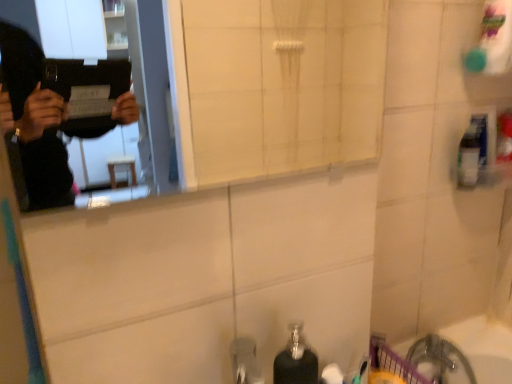
Question: Can you confirm if white plastic bath at lower right is taller than white glossy mirror at upper center?

Choices:
 (A) yes
 (B) no

Answer: (A)

Question: From the image's perspective, would you say white plastic bath at lower right is positioned over white glossy mirror at upper center?

Choices:
 (A) yes
 (B) no

Answer: (B)

Question: Can white glossy mirror at upper center be found inside white plastic bath at lower right?

Choices:
 (A) yes
 (B) no

Answer: (B)

Question: Is white plastic bath at lower right positioned beyond the bounds of white glossy mirror at upper center?

Choices:
 (A) no
 (B) yes

Answer: (B)

Question: Is white plastic bath at lower right in contact with white glossy mirror at upper center?

Choices:
 (A) yes
 (B) no

Answer: (B)

Question: Is the position of white plastic bath at lower right more distant than that of white glossy mirror at upper center?

Choices:
 (A) yes
 (B) no

Answer: (A)

Question: Is clear plastic bottle at upper right touching black matte soap dispenser at lower center?

Choices:
 (A) no
 (B) yes

Answer: (A)

Question: From the image's perspective, is clear plastic bottle at upper right below black matte soap dispenser at lower center?

Choices:
 (A) yes
 (B) no

Answer: (B)

Question: Is clear plastic bottle at upper right positioned beyond the bounds of black matte soap dispenser at lower center?

Choices:
 (A) no
 (B) yes

Answer: (B)

Question: Is clear plastic bottle at upper right surrounding black matte soap dispenser at lower center?

Choices:
 (A) no
 (B) yes

Answer: (A)

Question: Can you confirm if clear plastic bottle at upper right is positioned to the left of black matte soap dispenser at lower center?

Choices:
 (A) no
 (B) yes

Answer: (A)

Question: Can you confirm if clear plastic bottle at upper right is thinner than black matte soap dispenser at lower center?

Choices:
 (A) yes
 (B) no

Answer: (B)

Question: Can you confirm if white glossy mirror at upper center is smaller than clear plastic bottle at upper right?

Choices:
 (A) no
 (B) yes

Answer: (A)